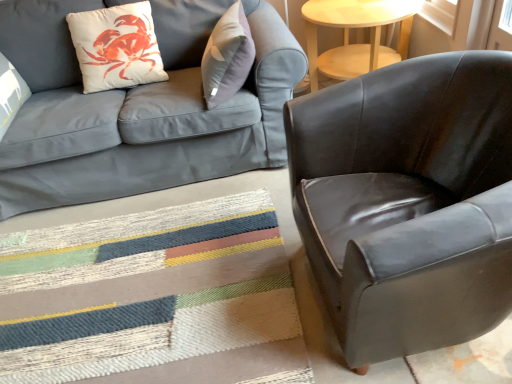
Question: Considering the relative positions of light wood round table at upper right and textured woven mat at lower center in the image provided, is light wood round table at upper right to the left of textured woven mat at lower center from the viewer's perspective?

Choices:
 (A) no
 (B) yes

Answer: (A)

Question: Is textured woven mat at lower center completely or partially inside light wood round table at upper right?

Choices:
 (A) no
 (B) yes

Answer: (A)

Question: Is light wood round table at upper right bigger than textured woven mat at lower center?

Choices:
 (A) yes
 (B) no

Answer: (A)

Question: Is light wood round table at upper right not close to textured woven mat at lower center?

Choices:
 (A) no
 (B) yes

Answer: (B)

Question: From a real-world perspective, is light wood round table at upper right below textured woven mat at lower center?

Choices:
 (A) no
 (B) yes

Answer: (A)

Question: Does light wood round table at upper right have a lesser width compared to textured woven mat at lower center?

Choices:
 (A) no
 (B) yes

Answer: (B)

Question: Is matte gray fabric couch at upper left surrounded by glossy leather armchair at right?

Choices:
 (A) no
 (B) yes

Answer: (A)

Question: From a real-world perspective, is glossy leather armchair at right physically above matte gray fabric couch at upper left?

Choices:
 (A) no
 (B) yes

Answer: (A)

Question: Is glossy leather armchair at right closer to the viewer compared to matte gray fabric couch at upper left?

Choices:
 (A) yes
 (B) no

Answer: (A)

Question: Is glossy leather armchair at right positioned far away from matte gray fabric couch at upper left?

Choices:
 (A) yes
 (B) no

Answer: (B)

Question: Is glossy leather armchair at right positioned beyond the bounds of matte gray fabric couch at upper left?

Choices:
 (A) yes
 (B) no

Answer: (A)

Question: Considering the relative sizes of glossy leather armchair at right and matte gray fabric couch at upper left in the image provided, is glossy leather armchair at right shorter than matte gray fabric couch at upper left?

Choices:
 (A) no
 (B) yes

Answer: (B)

Question: Considering the relative positions of white matte throw pillow at upper left and matte gray fabric couch at upper left in the image provided, is white matte throw pillow at upper left to the left of matte gray fabric couch at upper left from the viewer's perspective?

Choices:
 (A) yes
 (B) no

Answer: (B)